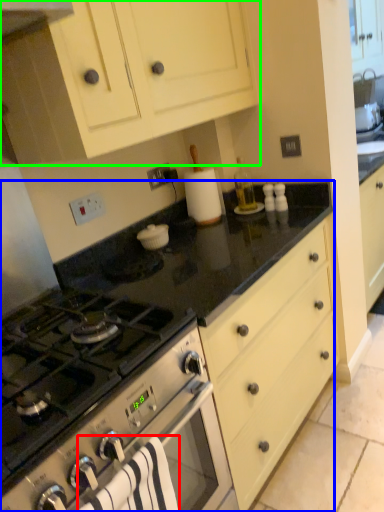
Question: Which object is positioned farthest from bath towel (highlighted by a red box)? Select from countertop (highlighted by a blue box) and cabinetry (highlighted by a green box).

Choices:
 (A) countertop
 (B) cabinetry

Answer: (B)